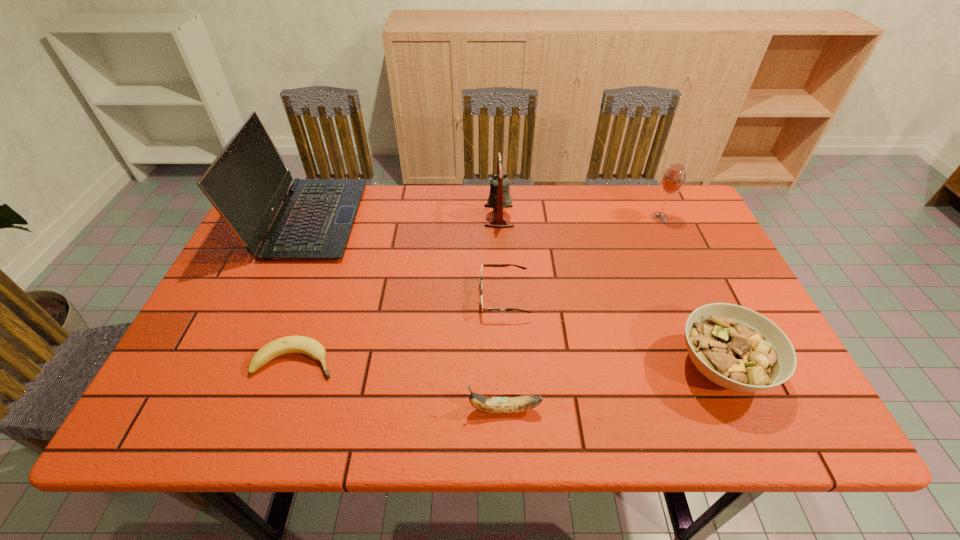
You are a GUI agent. You are given a task and a screenshot of the screen. Output one action in this format:
    pyautogui.click(x=<x>, y=<y>)
    Task: Click on the laptop computer
    This screenshot has width=960, height=540.
    Given the screenshot: What is the action you would take?
    pyautogui.click(x=247, y=182)

The image size is (960, 540). I want to click on bell, so click(x=499, y=197).

At what (x,y) coordinates should I click in order to perform the action: click on wineglass. Please return your answer as a coordinate pair (x, y). Image resolution: width=960 pixels, height=540 pixels. Looking at the image, I should click on (673, 179).

Locate an element on the screen. The height and width of the screenshot is (540, 960). stew is located at coordinates (737, 348).

Locate an element on the screen. the right banana is located at coordinates (497, 405).

I want to click on the taller banana, so click(497, 405).

Find the location of a particular element. The image size is (960, 540). the fourth nearest object is located at coordinates (483, 265).

Where is `the sixth tallest object`? The height and width of the screenshot is (540, 960). the sixth tallest object is located at coordinates (483, 265).

This screenshot has height=540, width=960. What are the coordinates of `the shorter banana` in the screenshot? It's located at (290, 344).

This screenshot has width=960, height=540. I want to click on the left banana, so click(290, 344).